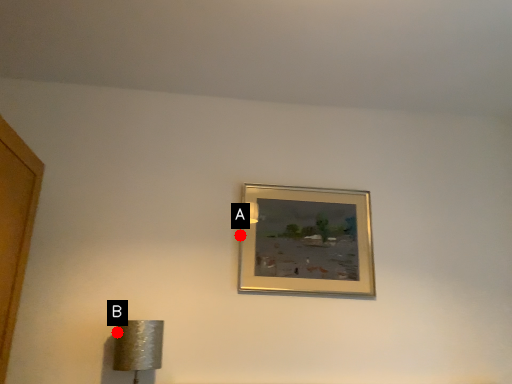
Question: Two points are circled on the image, labeled by A and B beside each circle. Which point is farther from the camera taking this photo?

Choices:
 (A) A is further
 (B) B is further

Answer: (A)